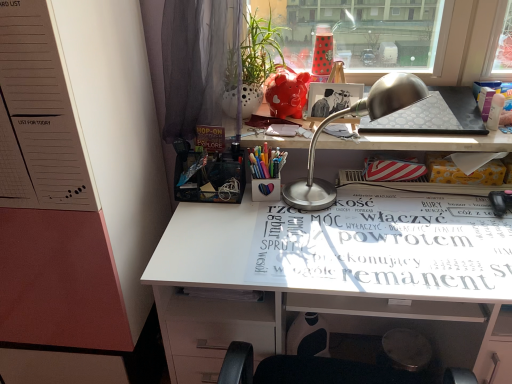
In order to face white dotted pot at upper center, should I rotate leftwards or rightwards?

Turn right approximately 0.075 degrees to face it.

At what (x,y) coordinates should I click in order to perform the action: click on silver metallic desk lamp at upper center. Please return your answer as a coordinate pair (x, y). The image size is (512, 384). Looking at the image, I should click on (357, 115).

Locate an element on the screen. white dotted pot at upper center is located at coordinates (254, 51).

Does silver metallic desk lamp at upper center have a smaller size compared to translucent plastic bottle at upper right, the second stationery from the bottom?

No, silver metallic desk lamp at upper center is not smaller than translucent plastic bottle at upper right, the second stationery from the bottom.

Which object is wider, silver metallic desk lamp at upper center or translucent plastic bottle at upper right, acting as the 2th stationery starting from the left?

With larger width is silver metallic desk lamp at upper center.

Are silver metallic desk lamp at upper center and translucent plastic bottle at upper right, the 1th stationery from the right, making contact?

No, silver metallic desk lamp at upper center is not beside translucent plastic bottle at upper right, the 1th stationery from the right.

Which is in front, point (311, 190) or point (497, 116)?

The point (311, 190) is in front.

Which is nearer, (x=257, y=177) or (x=380, y=294)?

Point (x=257, y=177) is farther from the camera than point (x=380, y=294).

In the scene shown: Which of these two, multicolored plastic pen set at center, the 2th stationery positioned from the right, or white glossy desk at center, is thinner?

multicolored plastic pen set at center, the 2th stationery positioned from the right.

From a real-world perspective, relative to white glossy desk at center, is multicolored plastic pen set at center, which is the 1th stationery from bottom to top, vertically above or below?

multicolored plastic pen set at center, which is the 1th stationery from bottom to top, is situated higher than white glossy desk at center in the real world.

Is multicolored plastic pen set at center, the 2th stationery positioned from the right, situated inside white glossy desk at center or outside?

multicolored plastic pen set at center, the 2th stationery positioned from the right, is spatially situated outside white glossy desk at center.

From the image's perspective, who appears lower, multicolored plastic pen set at center, the 2th stationery positioned from the top, or white dotted pot at upper center?

multicolored plastic pen set at center, the 2th stationery positioned from the top.

Which is nearer, (260, 152) or (270, 63)?

Clearly, point (260, 152) is closer to the camera than point (270, 63).

Based on their sizes in the image, would you say multicolored plastic pen set at center, the 2th stationery positioned from the right, is bigger or smaller than white dotted pot at upper center?

Considering their sizes, multicolored plastic pen set at center, the 2th stationery positioned from the right, takes up less space than white dotted pot at upper center.

From a real-world perspective, is multicolored plastic pen set at center, which is the 1th stationery from bottom to top, physically below white dotted pot at upper center?

Correct, in the physical world, multicolored plastic pen set at center, which is the 1th stationery from bottom to top, is lower than white dotted pot at upper center.

Considering the points (262, 150) and (311, 226), which point is behind, point (262, 150) or point (311, 226)?

Point (262, 150)

Can you confirm if multicolored plastic pen set at center, the 2th stationery positioned from the top, is thinner than white paper magazine at center?

Correct, the width of multicolored plastic pen set at center, the 2th stationery positioned from the top, is less than that of white paper magazine at center.

Is multicolored plastic pen set at center, which ranks as the first stationery in left-to-right order, directly adjacent to white paper magazine at center?

They are not placed beside each other.

Based on their positions, is white dotted pot at upper center located to the left or right of silver metallic desk lamp at upper center?

white dotted pot at upper center is positioned on silver metallic desk lamp at upper center's left side.

This screenshot has width=512, height=384. Identify the location of plant behind the silver metallic desk lamp at upper center. (254, 51).

Is white dotted pot at upper center taller than silver metallic desk lamp at upper center?

No, white dotted pot at upper center is not taller than silver metallic desk lamp at upper center.

Is white dotted pot at upper center inside or outside of silver metallic desk lamp at upper center?

white dotted pot at upper center is spatially situated outside silver metallic desk lamp at upper center.

Which of these two, white glossy dresser at left or white dotted pot at upper center, is thinner?

white dotted pot at upper center.

Locate an element on the screen. plant above the white glossy dresser at left (from the image's perspective) is located at coordinates (254, 51).

Between point (58, 132) and point (233, 76), which one is positioned in front?

The point (58, 132) is closer to the camera.

From the picture: From the image's perspective, is white glossy dresser at left positioned above or below white dotted pot at upper center?

Based on their image positions, white glossy dresser at left is located beneath white dotted pot at upper center.

Looking at this image, from the image's perspective, is white glossy dresser at left above or below multicolored plastic pen set at center, the 2th stationery positioned from the top?

white glossy dresser at left is situated lower than multicolored plastic pen set at center, the 2th stationery positioned from the top, in the image.

Measure the distance from white glossy dresser at left to multicolored plastic pen set at center, which is the 1th stationery from bottom to top.

A distance of 23.03 inches exists between white glossy dresser at left and multicolored plastic pen set at center, which is the 1th stationery from bottom to top.

Is white glossy dresser at left aimed at multicolored plastic pen set at center, the 2th stationery positioned from the right?

No.

Is white glossy dresser at left far from multicolored plastic pen set at center, which is the 1th stationery from bottom to top?

No.

At what (x,y) coordinates should I click in order to perform the action: click on lamp in front of the translucent plastic bottle at upper right, the second stationery from the bottom. Please return your answer as a coordinate pair (x, y). Image resolution: width=512 pixels, height=384 pixels. Looking at the image, I should click on (357, 115).

Image resolution: width=512 pixels, height=384 pixels. In order to click on the 1st stationery above the white glossy desk at center (from the image's perspective) in this screenshot , I will do `click(266, 161)`.

From the image, which object appears to be nearer to white dotted pot at upper center, translucent plastic bottle at upper right, the 1th stationery from the right, or silver metallic desk lamp at upper center?

silver metallic desk lamp at upper center is positioned closer to the anchor white dotted pot at upper center.

From the image, which object appears to be farther from silver metallic desk lamp at upper center, multicolored plastic pen set at center, the 2th stationery positioned from the right, or white dotted pot at upper center?

Among the two, white dotted pot at upper center is located further to silver metallic desk lamp at upper center.

Which object lies nearer to the anchor point white glossy dresser at left, silver metallic desk lamp at upper center or white glossy desk at center?

white glossy desk at center is positioned closer to the anchor white glossy dresser at left.

Which object lies nearer to the anchor point white glossy dresser at left, multicolored plastic pen set at center, which ranks as the first stationery in left-to-right order, or white dotted pot at upper center?

white dotted pot at upper center is positioned closer to the anchor white glossy dresser at left.

When comparing their distances from white glossy desk at center, does multicolored plastic pen set at center, the 2th stationery positioned from the top, or silver metallic desk lamp at upper center seem closer?

silver metallic desk lamp at upper center is closer to white glossy desk at center.

Based on their spatial positions, is translucent plastic bottle at upper right, acting as the 2th stationery starting from the left, or white dotted pot at upper center closer to white glossy desk at center?

Based on the image, white dotted pot at upper center appears to be nearer to white glossy desk at center.

In the scene shown: Considering their positions, is multicolored plastic pen set at center, which ranks as the first stationery in left-to-right order, positioned further to white glossy desk at center than white dotted pot at upper center?

Among the two, white dotted pot at upper center is located further to white glossy desk at center.

Looking at the image, which one is located further to white glossy desk at center, multicolored plastic pen set at center, which is the 1th stationery from bottom to top, or white paper magazine at center?

Among the two, multicolored plastic pen set at center, which is the 1th stationery from bottom to top, is located further to white glossy desk at center.

Locate an element on the screen. lamp between white glossy dresser at left and white paper magazine at center in the horizontal direction is located at coordinates [357, 115].

Find the location of a particular element. This screenshot has width=512, height=384. plant between white glossy dresser at left and multicolored plastic pen set at center, the 2th stationery positioned from the top is located at coordinates (x=254, y=51).

You are a GUI agent. You are given a task and a screenshot of the screen. Output one action in this format:
    pyautogui.click(x=<x>, y=<y>)
    Task: Click on the stationery between white glossy dresser at left and silver metallic desk lamp at upper center
    
    Given the screenshot: What is the action you would take?
    pyautogui.click(x=266, y=161)

Locate an element on the screen. Image resolution: width=512 pixels, height=384 pixels. magazine between multicolored plastic pen set at center, which is the 1th stationery from bottom to top, and white glossy desk at center in the up-down direction is located at coordinates (386, 246).